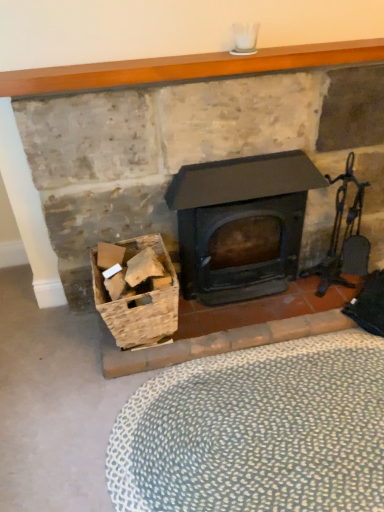
Identify the location of unoccupied region to the right of wooden crate at lower left. Image resolution: width=384 pixels, height=512 pixels. (x=216, y=339).